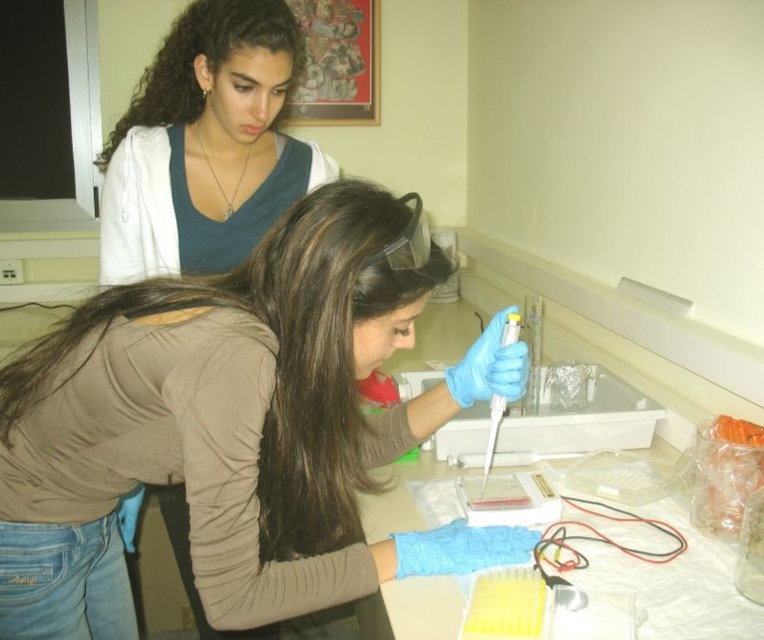
Question: Can you confirm if blue rubber glove at center is smaller than white plastic pipette at center?

Choices:
 (A) no
 (B) yes

Answer: (A)

Question: Which of these objects is positioned farthest from the blue rubber glove at center?

Choices:
 (A) white plastic pipette at center
 (B) matte blue shirt at upper left

Answer: (B)

Question: Which point appears closest to the camera in this image?

Choices:
 (A) (133, 232)
 (B) (8, 438)
 (C) (520, 321)

Answer: (B)

Question: Can you confirm if blue rubber glove at center is wider than white plastic pipette at center?

Choices:
 (A) yes
 (B) no

Answer: (A)

Question: Which point is closer to the camera taking this photo?

Choices:
 (A) (494, 432)
 (B) (83, 358)

Answer: (B)

Question: Is matte blue shirt at upper left bigger than white plastic pipette at center?

Choices:
 (A) yes
 (B) no

Answer: (A)